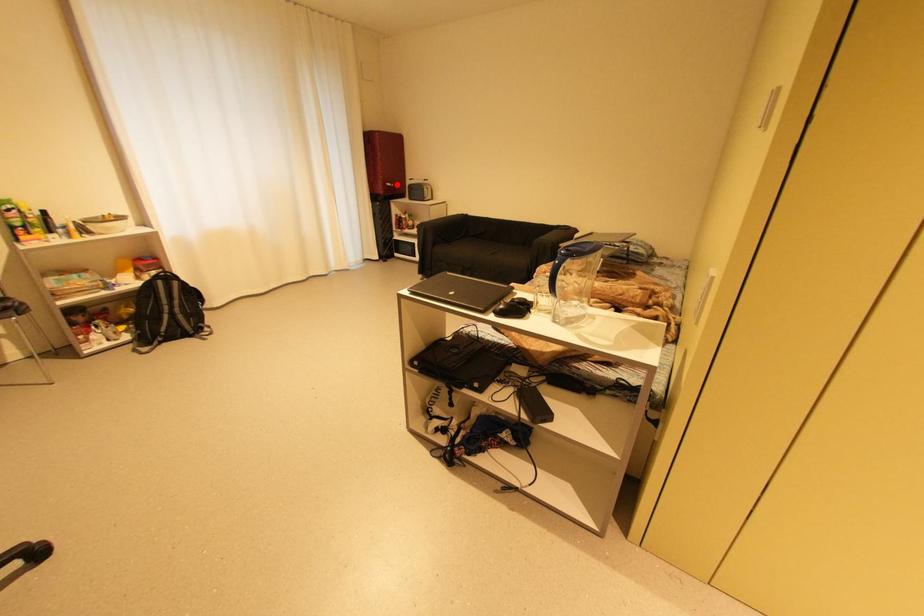
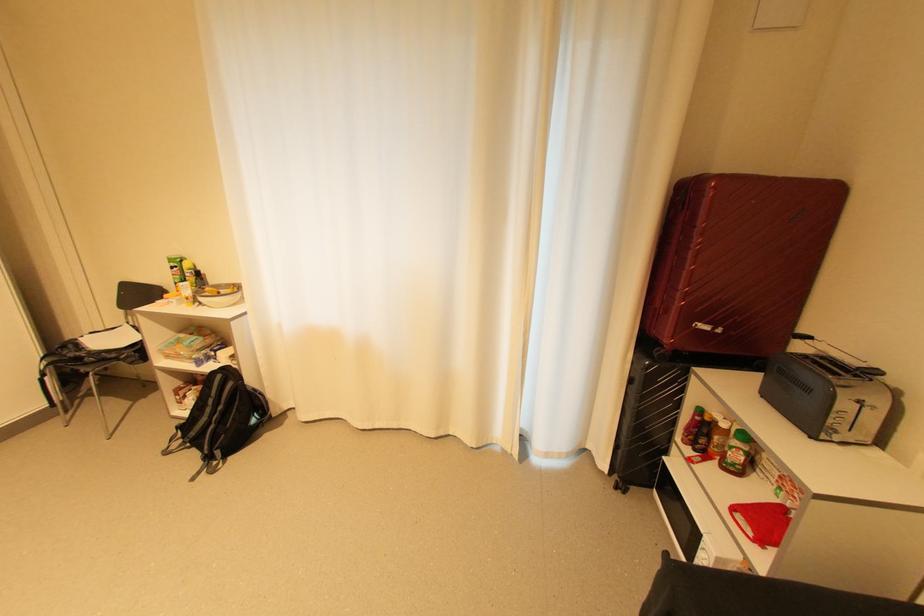
The point at the highlighted location is marked in the first image. Where is the corresponding point in the second image?

(713, 328)